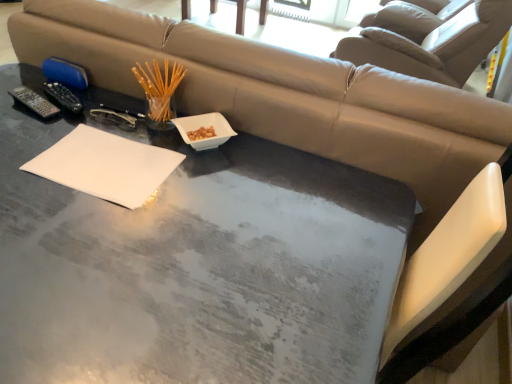
You are a GUI agent. You are given a task and a screenshot of the screen. Output one action in this format:
    pyautogui.click(x=<x>, y=<y>)
    Task: Click on the vacant space to the left of white matte notepad at center
    The image size is (512, 384).
    Given the screenshot: What is the action you would take?
    pyautogui.click(x=29, y=150)